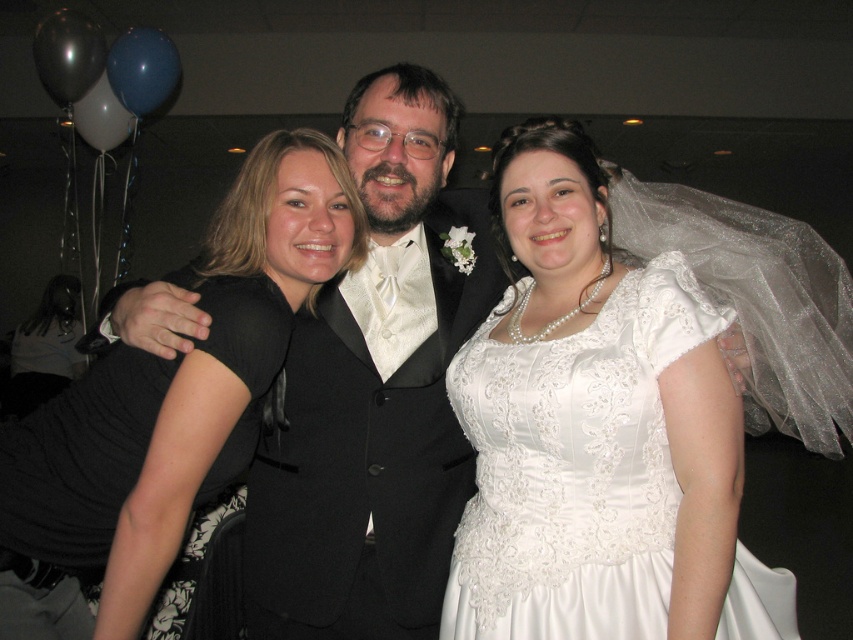
You are a photographer adjusting the lighting for the wedding photo. You need to place a small spotlight at point (376, 392). Which part of the scene will this spotlight illuminate?

The spotlight at point (376, 392) will illuminate the matte black suit at center.

You are a photographer at the wedding. You want to place a bouquet at point [596,432]. However, there is an object already there. What object is at that point?

The white satin dress at center is located at point [596,432].